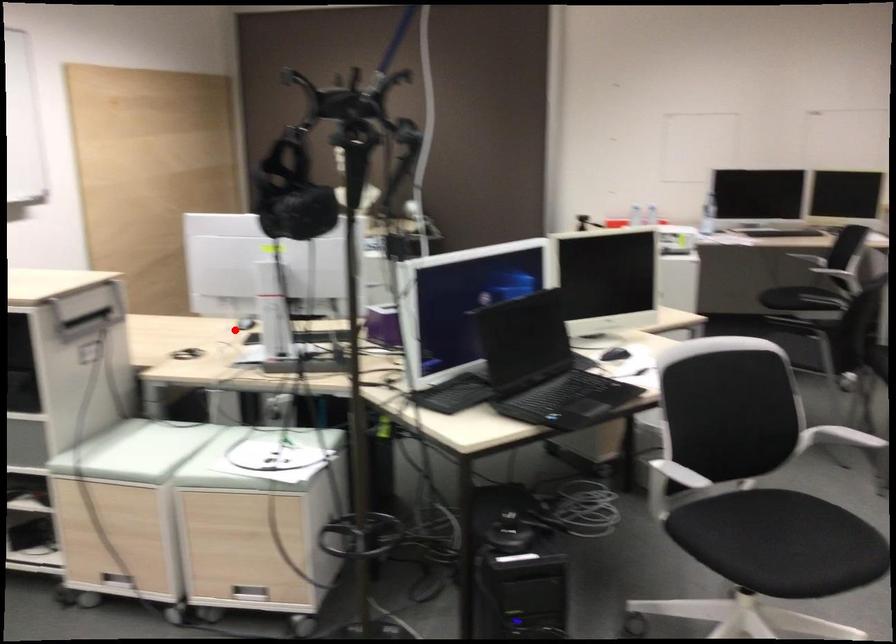
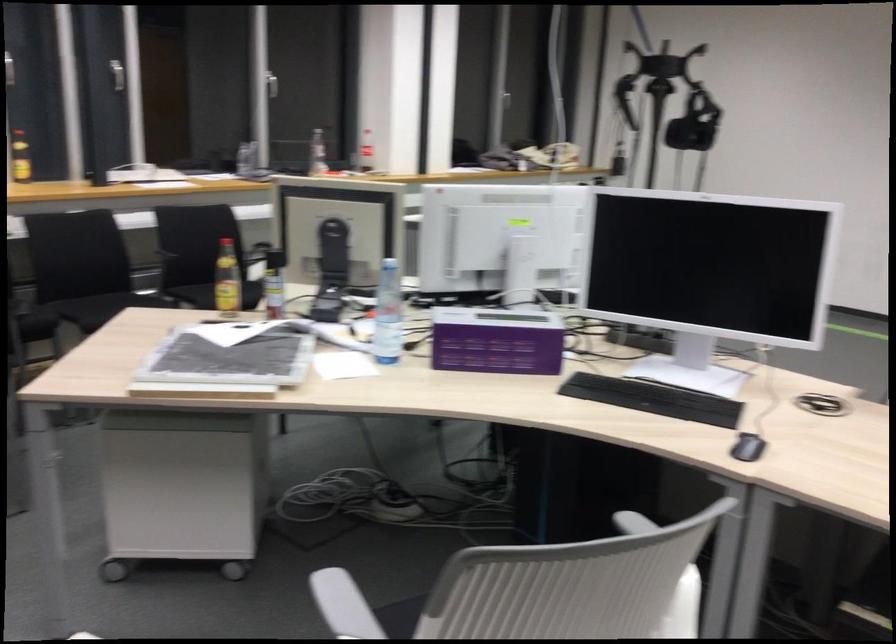
Find the pixel in the second image that matches the highlighted location in the first image.

(747, 447)